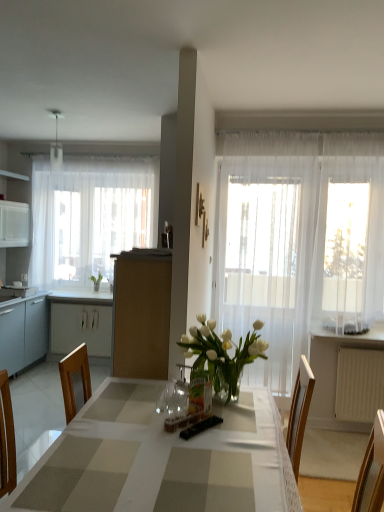
Question: Does white sheer curtain at left, which ranks as the first curtain in back-to-front order, have a greater height compared to white plastic radiator at lower right?

Choices:
 (A) no
 (B) yes

Answer: (B)

Question: Is white sheer curtain at left, the first curtain from the left, directly adjacent to white plastic radiator at lower right?

Choices:
 (A) no
 (B) yes

Answer: (A)

Question: Is the depth of white sheer curtain at left, which ranks as the first curtain in back-to-front order, less than that of white plastic radiator at lower right?

Choices:
 (A) no
 (B) yes

Answer: (A)

Question: Considering the relative sizes of white sheer curtain at left, which ranks as the first curtain in back-to-front order, and white plastic radiator at lower right in the image provided, is white sheer curtain at left, which ranks as the first curtain in back-to-front order, bigger than white plastic radiator at lower right?

Choices:
 (A) yes
 (B) no

Answer: (A)

Question: Can you confirm if white sheer curtain at left, positioned as the second curtain in front-to-back order, is wider than white plastic radiator at lower right?

Choices:
 (A) no
 (B) yes

Answer: (B)

Question: Can you confirm if checkered fabric table at center is taller than white matte cabinet at left, which is the second cabinetry from left to right?

Choices:
 (A) no
 (B) yes

Answer: (B)

Question: Is checkered fabric table at center oriented away from white matte cabinet at left, acting as the first cabinetry starting from the back?

Choices:
 (A) no
 (B) yes

Answer: (B)

Question: Would you say checkered fabric table at center contains white matte cabinet at left, acting as the first cabinetry starting from the back?

Choices:
 (A) no
 (B) yes

Answer: (A)

Question: Is checkered fabric table at center to the right of white matte cabinet at left, the second cabinetry positioned from the front, from the viewer's perspective?

Choices:
 (A) yes
 (B) no

Answer: (A)

Question: Can you confirm if checkered fabric table at center is bigger than white matte cabinet at left, the second cabinetry positioned from the front?

Choices:
 (A) no
 (B) yes

Answer: (B)

Question: Can we say checkered fabric table at center lies outside white matte cabinet at left, which is counted as the 1th cabinetry, starting from the right?

Choices:
 (A) yes
 (B) no

Answer: (A)

Question: Considering the relative positions of white plastic radiator at lower right and checkered fabric table at center in the image provided, is white plastic radiator at lower right to the right of checkered fabric table at center from the viewer's perspective?

Choices:
 (A) no
 (B) yes

Answer: (B)